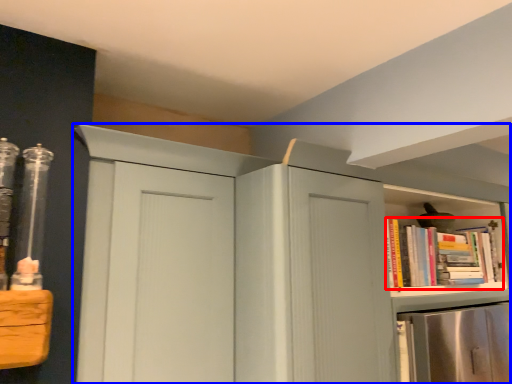
Question: Which of the following is the closest to the observer, book (highlighted by a red box) or cupboard (highlighted by a blue box)?

Choices:
 (A) book
 (B) cupboard

Answer: (B)